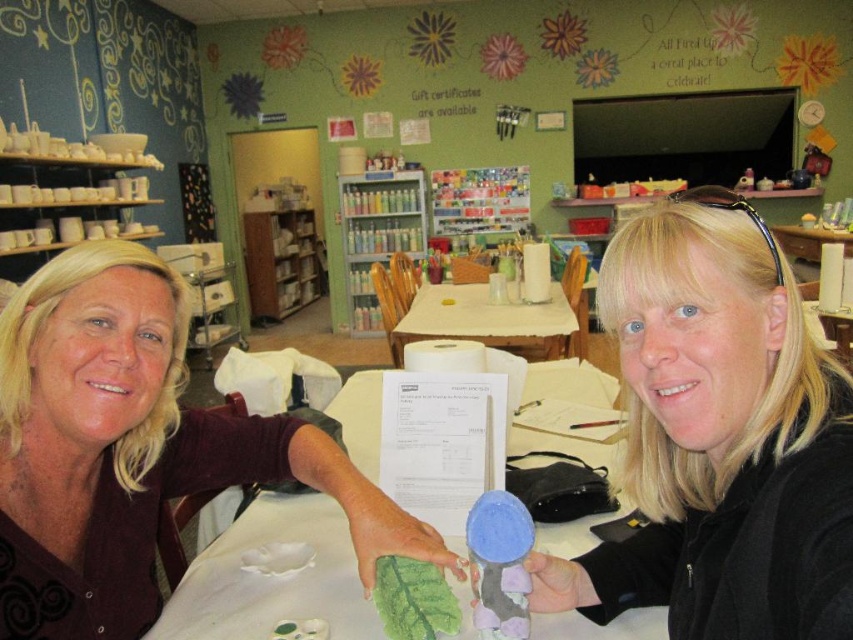
Question: Is white paper at center wider than white fabric-covered table at center?

Choices:
 (A) yes
 (B) no

Answer: (B)

Question: Which object appears closest to the camera in this image?

Choices:
 (A) matte blue plush toy at center
 (B) white fabric-covered table at center

Answer: (A)

Question: Is the position of white fabric-covered table at center less distant than that of matte blue plush toy at center?

Choices:
 (A) yes
 (B) no

Answer: (B)

Question: Can you confirm if metallic silver bookshelf at center is wider than wooden bookshelf at center?

Choices:
 (A) yes
 (B) no

Answer: (A)

Question: Which of the following is the farthest from the observer?

Choices:
 (A) matte black sweater at center
 (B) metallic silver bookshelf at center

Answer: (B)

Question: Among these points, which one is nearest to the camera?

Choices:
 (A) (267, 278)
 (B) (585, 545)

Answer: (B)